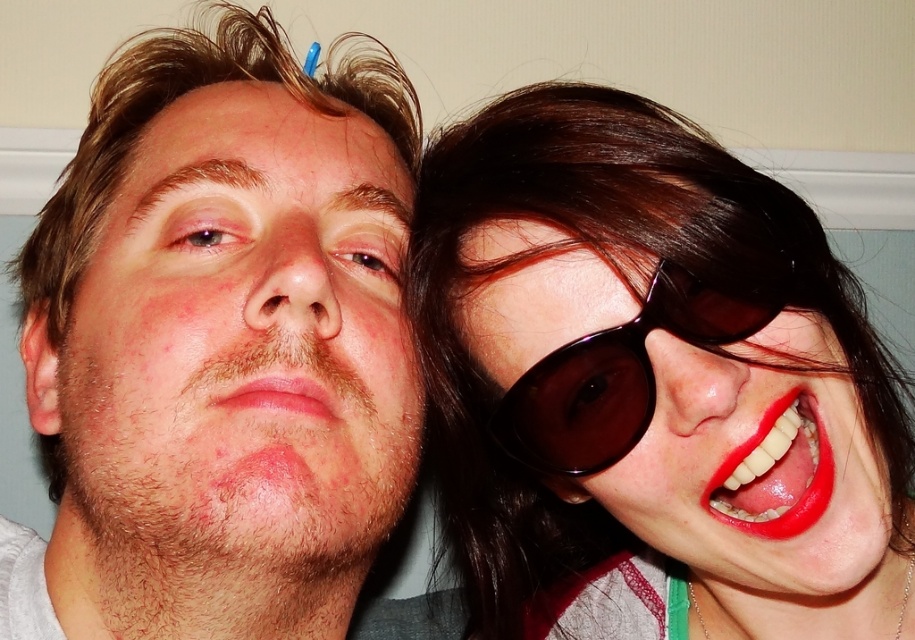
You are a photographer adjusting the camera settings. You notice the shiny brown hair at upper right and the glossy red lipstick at lower right in the frame. Which object is wider in the image?

The shiny brown hair at upper right is wider than the glossy red lipstick at lower right according to the description.

You are a photographer trying to adjust the lighting for a portrait. You notice the shiny brown hair at upper right and the glossy red lipstick at lower right. Which object is positioned to the left of the other?

The shiny brown hair at upper right is to the left of the glossy red lipstick at lower right.